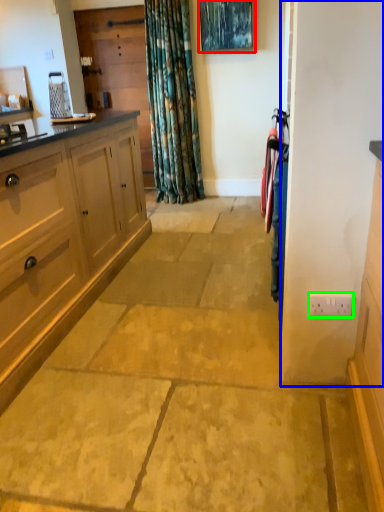
Question: Estimate the real-world distances between objects in this image. Which object is closer to picture frame (highlighted by a red box), screen door (highlighted by a blue box) or electric outlet (highlighted by a green box)?

Choices:
 (A) screen door
 (B) electric outlet

Answer: (A)